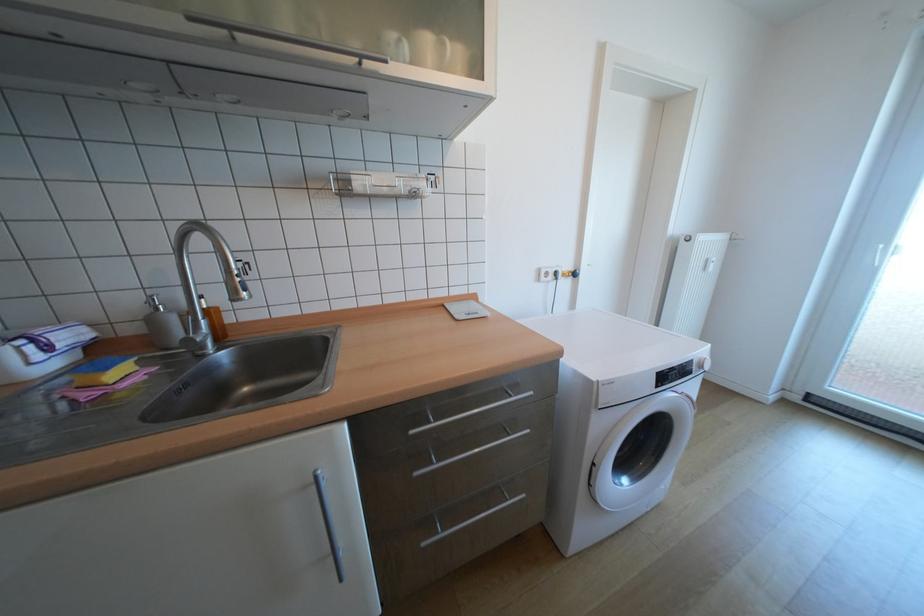
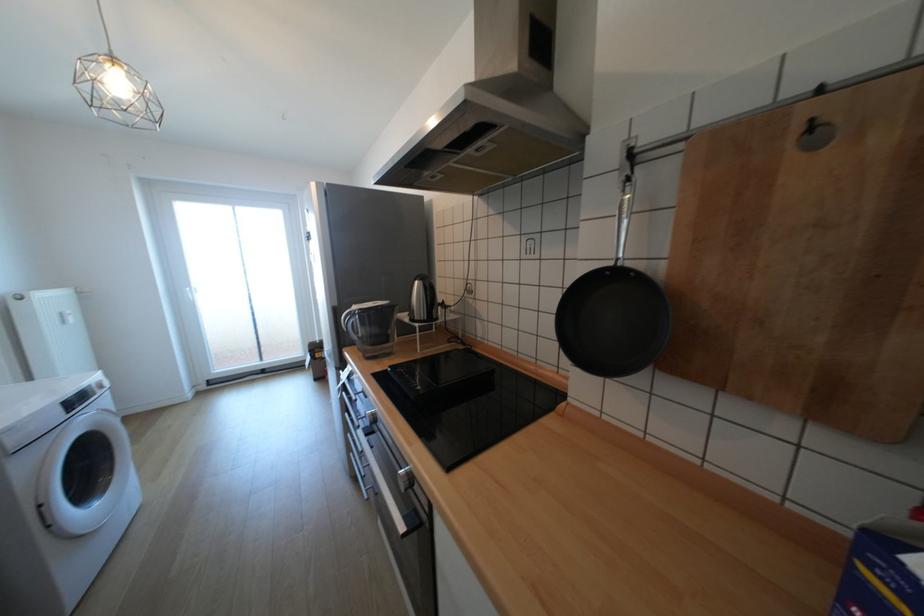
Question: The first image is from the beginning of the video and the second image is from the end. How did the camera likely rotate when shooting the video?

Choices:
 (A) Left
 (B) Right
 (C) Up
 (D) Down

Answer: (B)